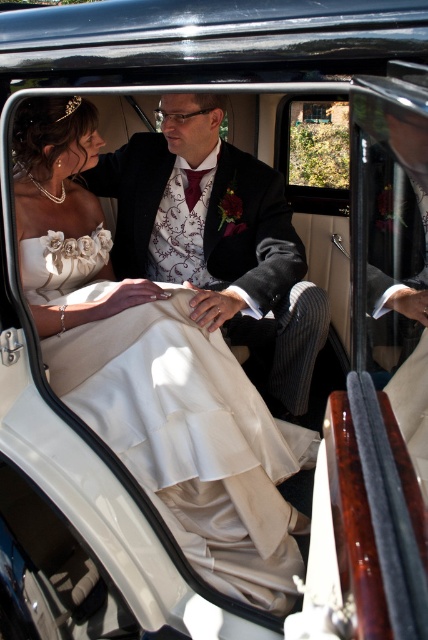
Between point (240, 577) and point (278, 365), which one is positioned behind?

The point (278, 365) is behind.

Where is `satin/crepe wedding dress at center`? This screenshot has height=640, width=428. satin/crepe wedding dress at center is located at coordinates (190, 440).

Is point (279, 512) behind point (315, 342)?

No, (279, 512) is closer to viewer.

At what (x,y) coordinates should I click in order to perform the action: click on satin/crepe wedding dress at center. Please return your answer as a coordinate pair (x, y). This screenshot has height=640, width=428. Looking at the image, I should click on (190, 440).